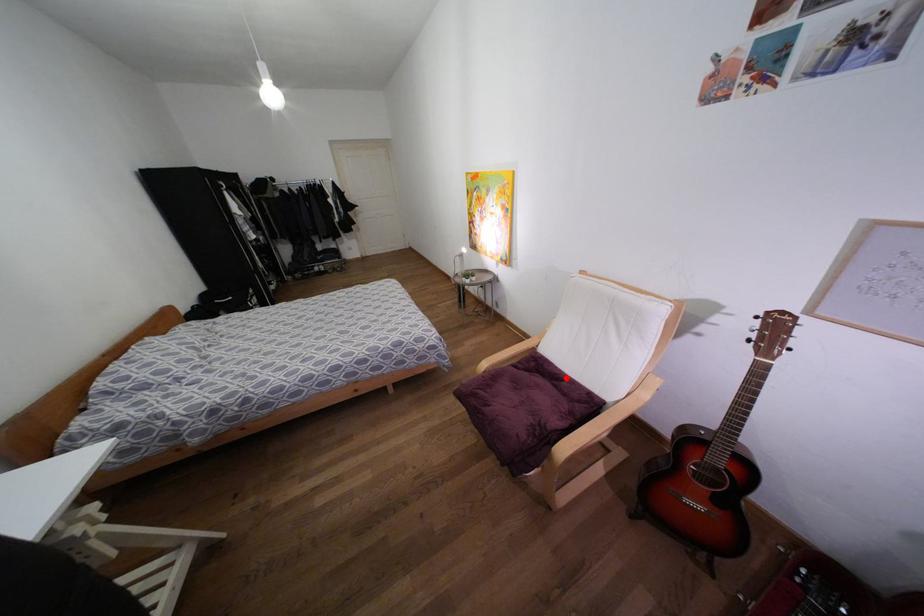
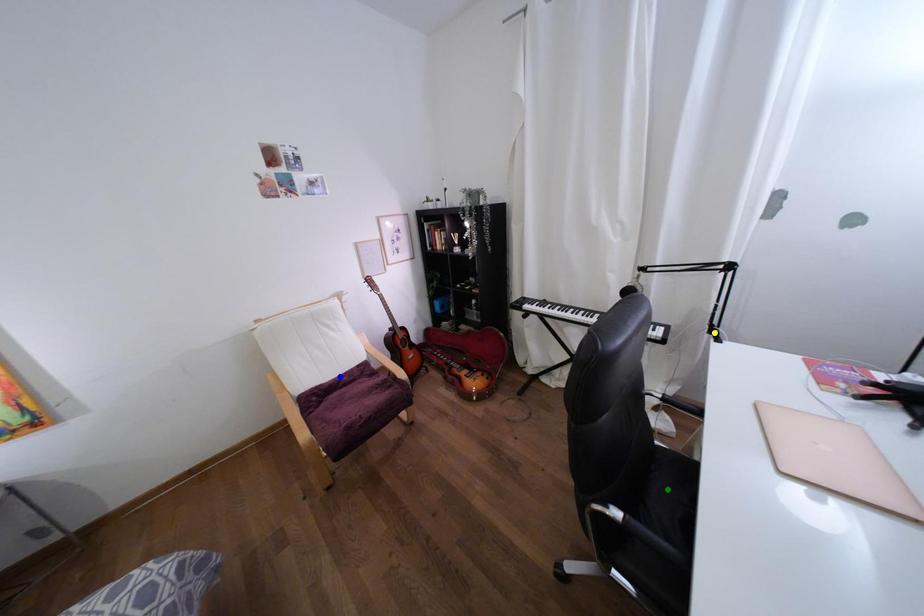
Question: I am providing you with two images of the same scene from different viewpoints. A red point is marked on the first image. You are given multiple points on the second image. Which point in image 2 is actually the same real-world point as the red point in image 1?

Choices:
 (A) green point
 (B) blue point
 (C) yellow point

Answer: (B)